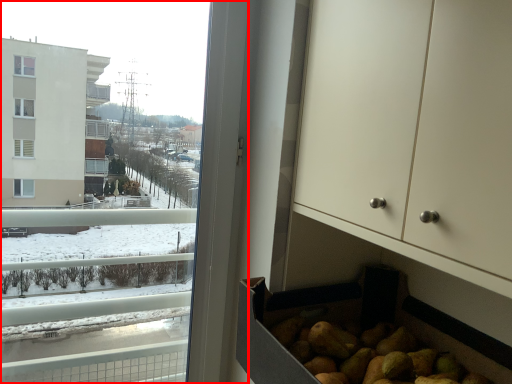
Question: From the image, what is the correct spatial relationship of window (annotated by the red box) in relation to dresser?

Choices:
 (A) left
 (B) right

Answer: (A)